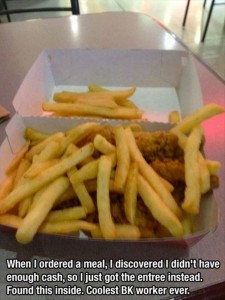
Locate an element on the screen. The image size is (225, 300). table is located at coordinates (82, 35).